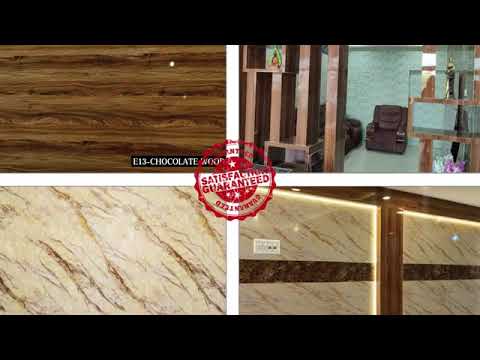
Locate an element on the screen. The height and width of the screenshot is (360, 480). light switch is located at coordinates (267, 244).